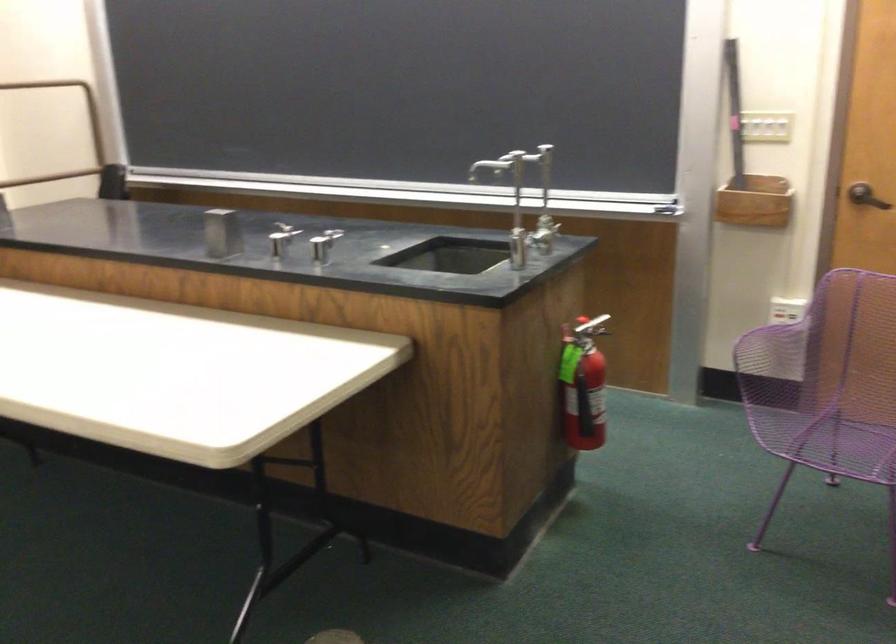
Image resolution: width=896 pixels, height=644 pixels. Find the location of `silver faucet lever`. silver faucet lever is located at coordinates (540, 156).